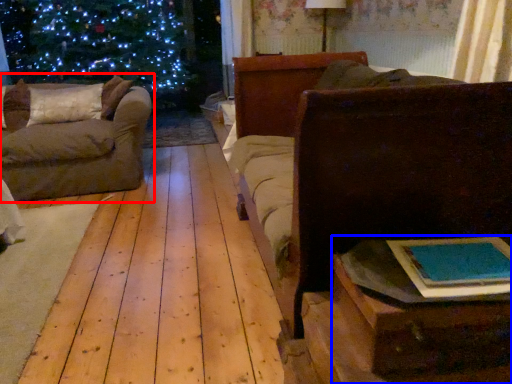
Question: Which point is closer to the camera, studio couch (highlighted by a red box) or table (highlighted by a blue box)?

Choices:
 (A) studio couch
 (B) table

Answer: (B)